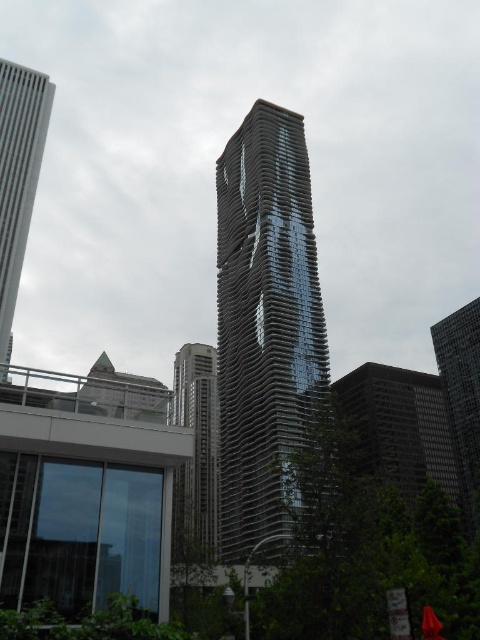
Is glossy glass tower at center behind dark gray concrete building at center?

That is False.

Is glossy glass tower at center shorter than dark gray concrete building at center?

No.

Is point (287, 442) less distant than point (411, 449)?

That is True.

I want to click on glossy glass tower at center, so click(x=264, y=323).

Based on the photo, which is more to the left, dark gray concrete building at center or metallic glass skyscraper at center?

metallic glass skyscraper at center

The image size is (480, 640). Identify the location of dark gray concrete building at center. (398, 428).

I want to click on dark gray concrete building at center, so click(398, 428).

Does white glass skyscraper at left appear on the left side of metallic glass skyscraper at center?

Correct, you'll find white glass skyscraper at left to the left of metallic glass skyscraper at center.

Is point (32, 77) more distant than point (201, 545)?

Yes, point (32, 77) is behind point (201, 545).

The height and width of the screenshot is (640, 480). In order to click on white glass skyscraper at left in this screenshot , I will do `click(17, 176)`.